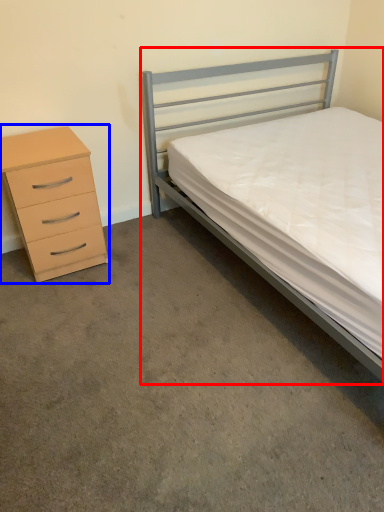
Question: Which object is further to the camera taking this photo, bed (highlighted by a red box) or chest of drawers (highlighted by a blue box)?

Choices:
 (A) bed
 (B) chest of drawers

Answer: (B)